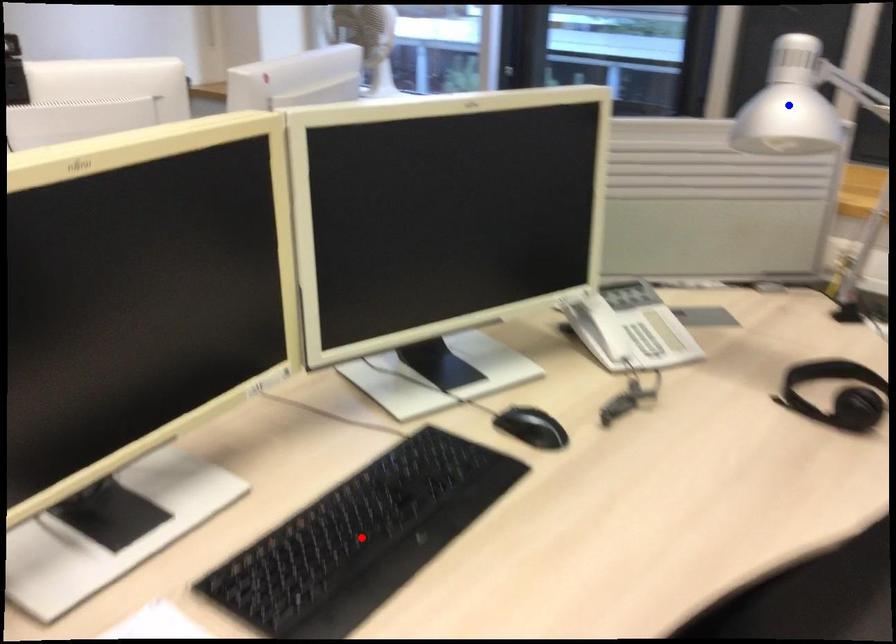
Question: Which of the two points in the image is closer to the camera?

Choices:
 (A) Blue point is closer.
 (B) Red point is closer.

Answer: (B)